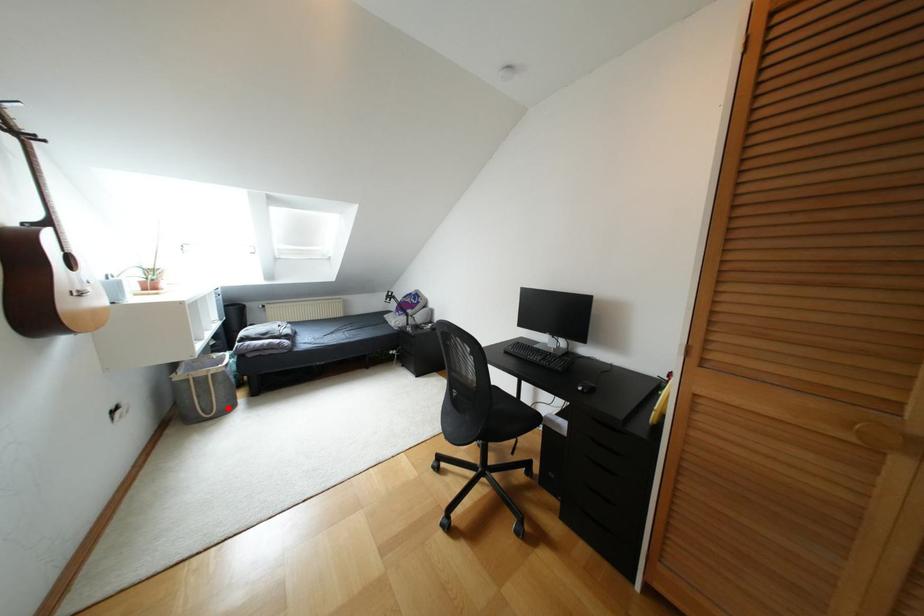
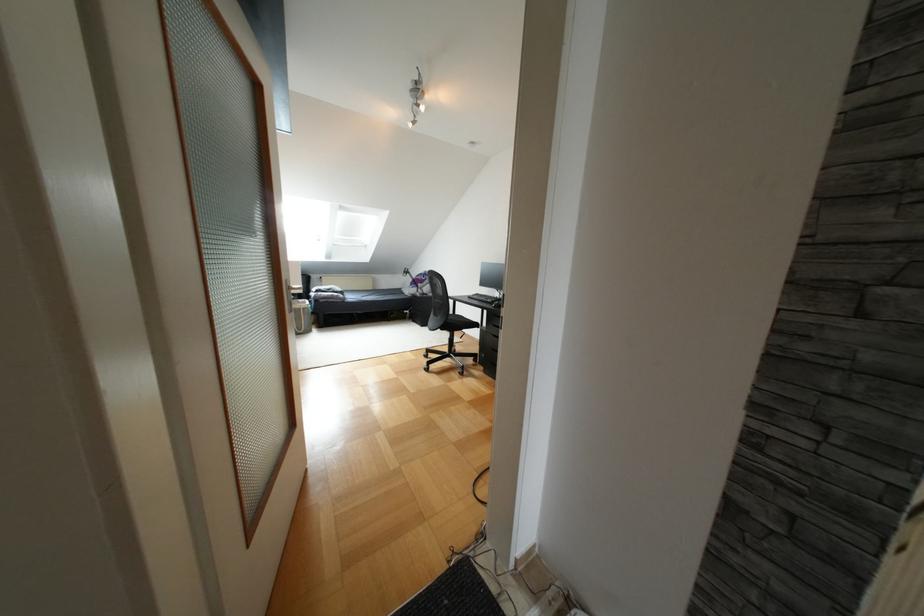
Question: I am providing you with two images of the same scene from different viewpoints. Image1 has a red point marked. In image2, the corresponding 3D location appears at what relative position? Reply with the corresponding letter.

Choices:
 (A) Closer
 (B) Farther

Answer: (B)